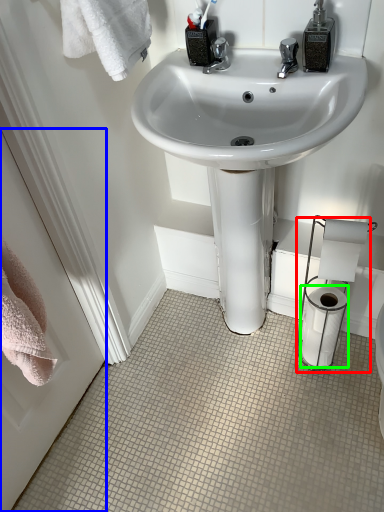
Question: Which object is positioned closest to toilet paper (highlighted by a red box)? Select from screen door (highlighted by a blue box) and toilet paper (highlighted by a green box).

Choices:
 (A) screen door
 (B) toilet paper

Answer: (B)